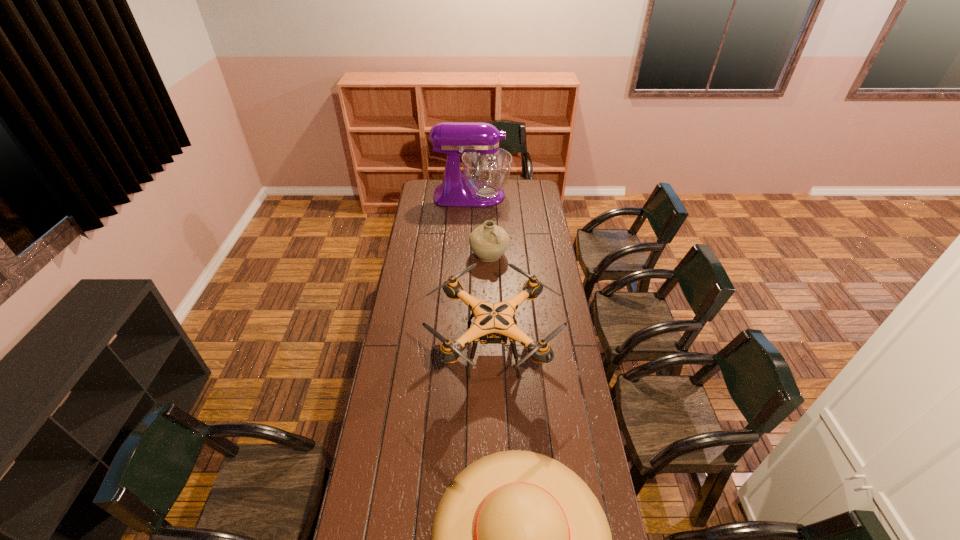
Image resolution: width=960 pixels, height=540 pixels. I want to click on vacant area between the farthest object and the third farthest object, so click(x=483, y=272).

Select which object appears as the second closest to the farthest object. Please provide its 2D coordinates. Your answer should be formatted as a tuple, i.e. [(x, y)], where the tuple contains the x and y coordinates of a point satisfying the conditions above.

[(493, 324)]

Identify which object is located as the second nearest to the second nearest object. Please provide its 2D coordinates. Your answer should be formatted as a tuple, i.e. [(x, y)], where the tuple contains the x and y coordinates of a point satisfying the conditions above.

[(488, 242)]

At what (x,y) coordinates should I click in order to perform the action: click on free space that satisfies the following two spatial constraints: 1. at the bowl opening of the farthest object; 2. on the back side of the second shortest object. Please return your answer as a coordinate pair (x, y). Looking at the image, I should click on (470, 255).